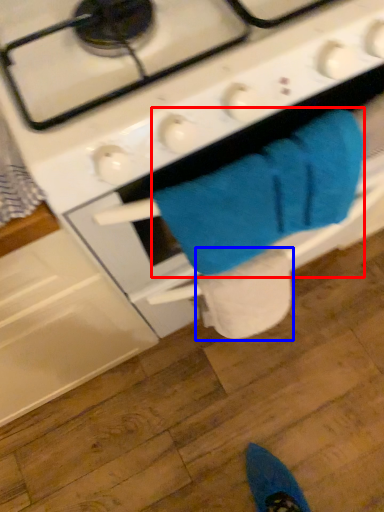
Question: Which object is further to the camera taking this photo, bath towel (highlighted by a red box) or toilet paper (highlighted by a blue box)?

Choices:
 (A) bath towel
 (B) toilet paper

Answer: (B)